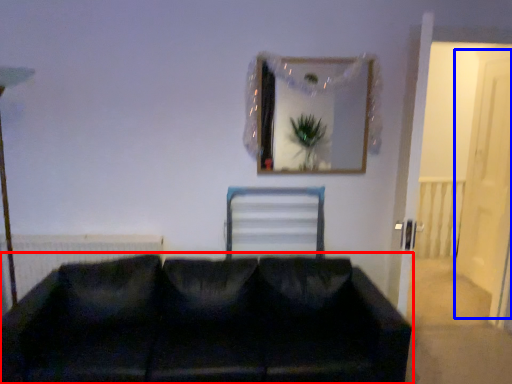
Question: Which point is further to the camera, studio couch (highlighted by a red box) or glass door (highlighted by a blue box)?

Choices:
 (A) studio couch
 (B) glass door

Answer: (B)